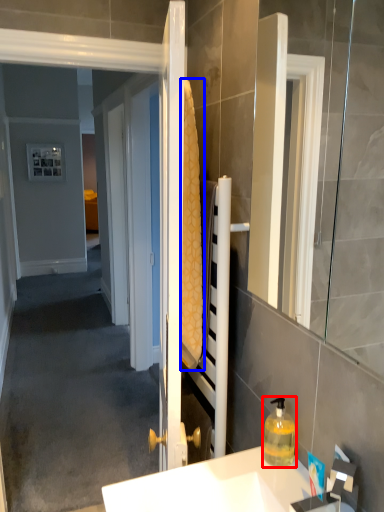
Question: Which of the following is the closest to the observer, bottle (highlighted by a red box) or bath towel (highlighted by a blue box)?

Choices:
 (A) bottle
 (B) bath towel

Answer: (B)